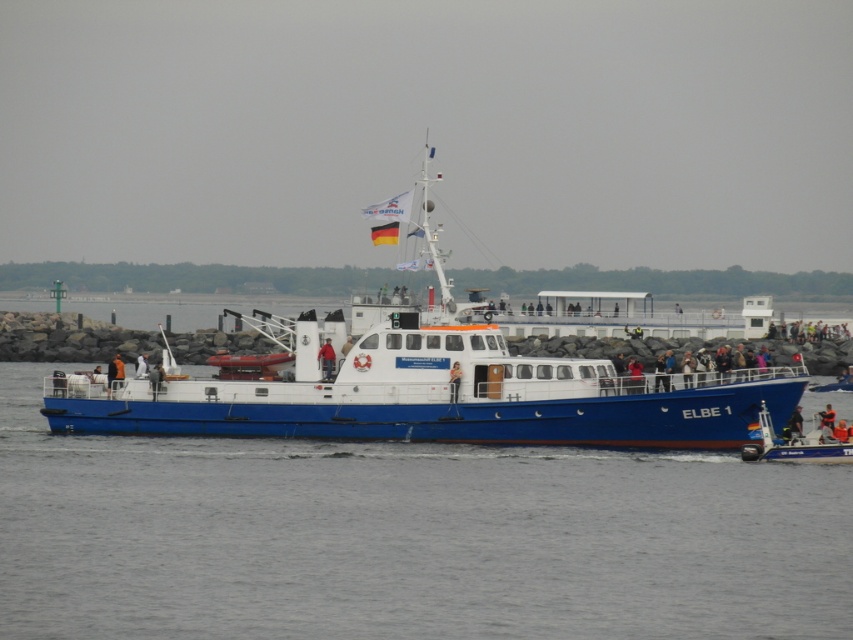
Question: Is blue metallic boat at lower right closer to camera compared to orange life vest at center?

Choices:
 (A) yes
 (B) no

Answer: (A)

Question: Which object is closer to the camera taking this photo?

Choices:
 (A) orange life vest at center
 (B) blue metallic boat at lower right
 (C) orange life vest at lower right
 (D) blue matte boat at center

Answer: (B)

Question: Which point is farther to the camera?

Choices:
 (A) (418, 324)
 (B) (111, 385)
 (C) (328, 356)

Answer: (B)

Question: Is blue metallic boat at lower right behind orange fabric jacket at center?

Choices:
 (A) no
 (B) yes

Answer: (A)

Question: Among these objects, which one is nearest to the camera?

Choices:
 (A) orange life vest at lower right
 (B) orange life vest at center
 (C) blue metallic boat at lower right

Answer: (C)

Question: Does blue matte boat at center lie behind blue metallic boat at lower right?

Choices:
 (A) no
 (B) yes

Answer: (B)